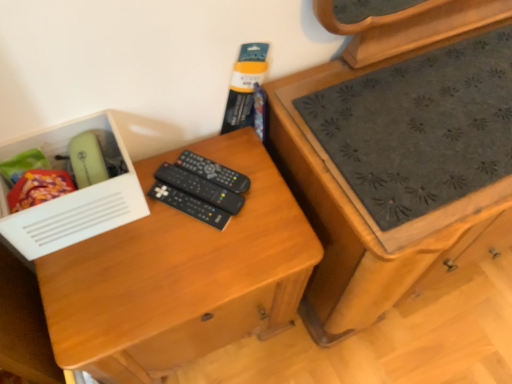
Where is `vacant space in front of black plastic remote controls at center, acting as the 3th remote control starting from the top`? vacant space in front of black plastic remote controls at center, acting as the 3th remote control starting from the top is located at coordinates (167, 273).